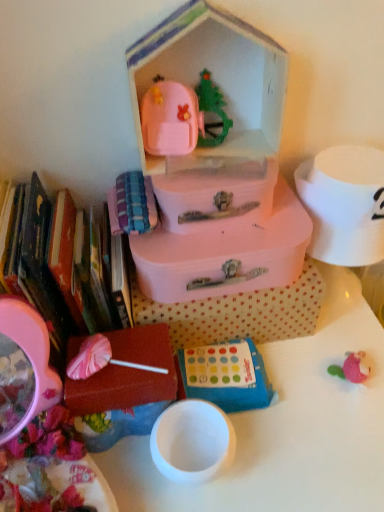
This screenshot has height=512, width=384. I want to click on empty space that is in between pink matte suitcase at center, the third storage box positioned from the top, and blue fabric game at center, so click(x=292, y=371).